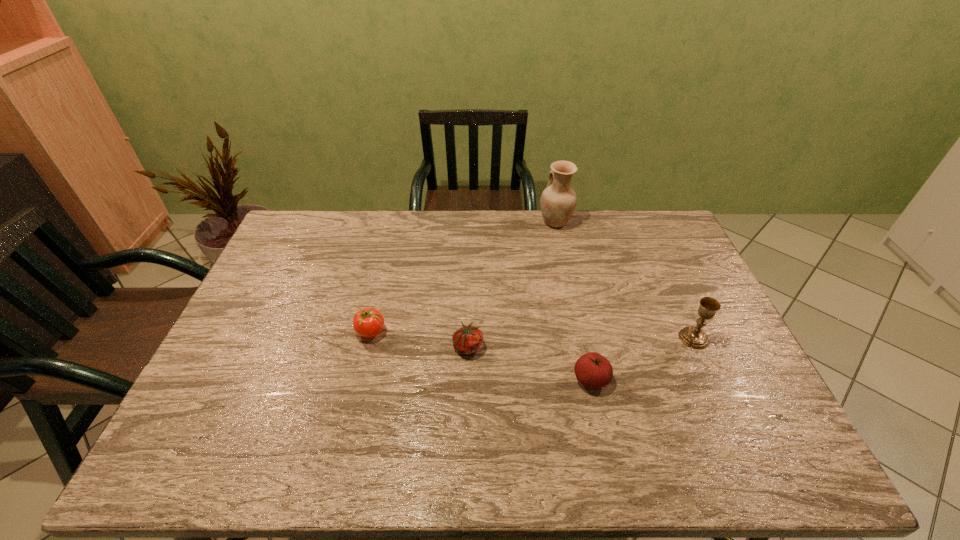
Find the location of a particular element. vacant space situated 0.170m on the front of the rightmost object is located at coordinates (723, 403).

At what (x,y) coordinates should I click in order to perform the action: click on vacant point located 0.160m on the left of the nearest tomato. Please return your answer as a coordinate pair (x, y). Looking at the image, I should click on (512, 379).

Locate an element on the screen. This screenshot has width=960, height=540. vacant space located 0.130m on the left of the leftmost tomato is located at coordinates (310, 332).

Locate an element on the screen. Image resolution: width=960 pixels, height=540 pixels. vacant space situated on the left of the second object from left to right is located at coordinates click(x=402, y=346).

At what (x,y) coordinates should I click in order to perform the action: click on object at the far edge. Please return your answer as a coordinate pair (x, y). The width and height of the screenshot is (960, 540). Looking at the image, I should click on (558, 201).

The height and width of the screenshot is (540, 960). Identify the location of object situated at the right edge. (x=694, y=337).

Image resolution: width=960 pixels, height=540 pixels. Identify the location of vacant region at the far edge of the desktop. (564, 238).

Where is `vacant space at the left edge of the desktop`? vacant space at the left edge of the desktop is located at coordinates (266, 383).

In the image, there is a desktop. Where is `vacant space at the right edge`? This screenshot has width=960, height=540. vacant space at the right edge is located at coordinates (700, 369).

Where is `free space at the far left corner of the desktop`? The height and width of the screenshot is (540, 960). free space at the far left corner of the desktop is located at coordinates (293, 217).